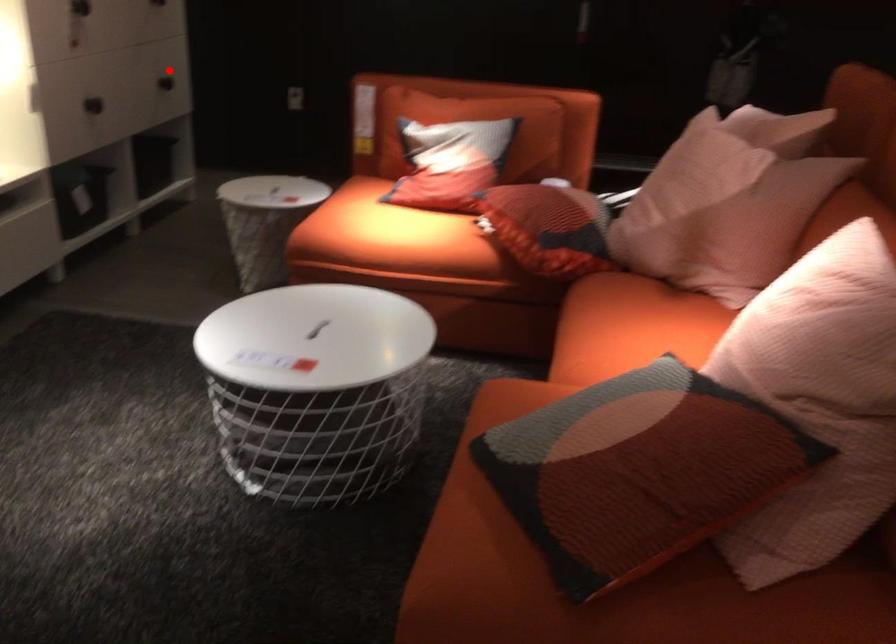
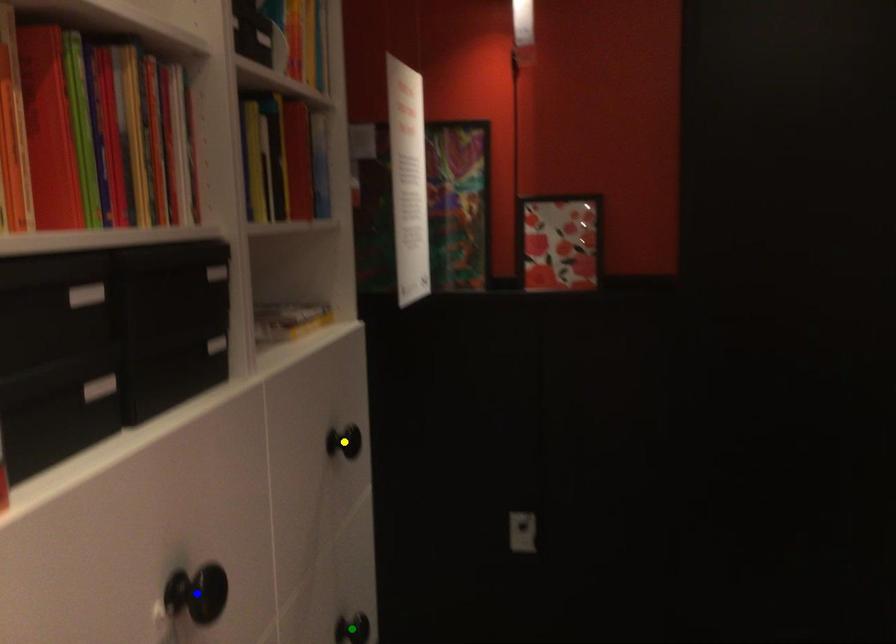
Question: I am providing you with two images of the same scene from different viewpoints. A red point is marked on the first image. You are given multiple points on the second image. Which mark in image 2 goes with the point in image 1?

Choices:
 (A) yellow point
 (B) blue point
 (C) green point

Answer: (C)